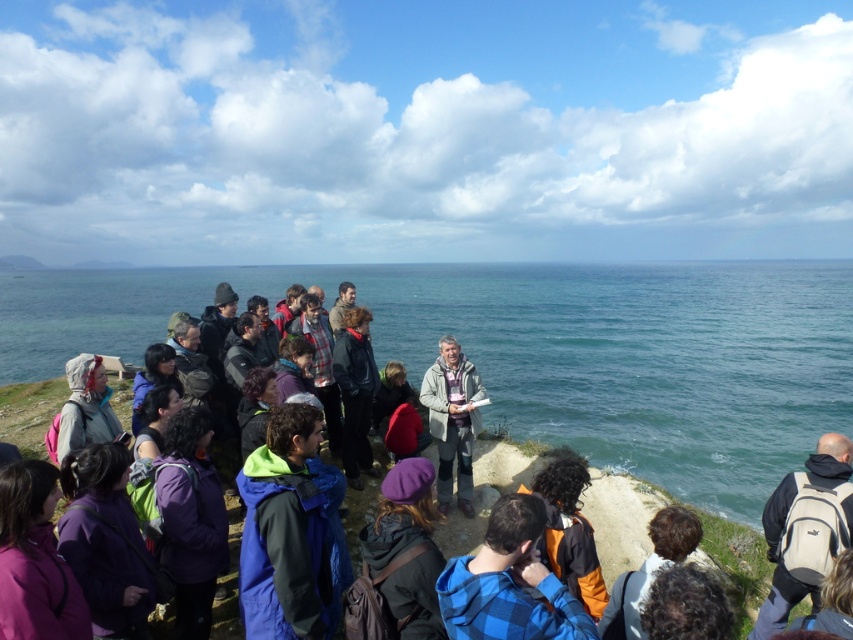
Question: Can you confirm if beige fabric backpack at lower right is positioned to the left of purple woolen hat at center?

Choices:
 (A) yes
 (B) no

Answer: (B)

Question: Which point is closer to the camera taking this photo?

Choices:
 (A) tap(476, 417)
 (B) tap(86, 300)
 (C) tap(16, 465)

Answer: (C)

Question: Can you confirm if orange fabric jacket at lower center is wider than brown woolen hat at lower right?

Choices:
 (A) no
 (B) yes

Answer: (A)

Question: Which of these objects is positioned farthest from the purple woolen hat at center?

Choices:
 (A) matte gray jacket at lower left
 (B) blue fabric jacket at lower left
 (C) purple fleece jacket at lower left

Answer: (A)

Question: Is blue water at center thinner than brown woolen hat at lower right?

Choices:
 (A) no
 (B) yes

Answer: (A)

Question: Which point is farther to the camera?

Choices:
 (A) (294, 504)
 (B) (576, 534)

Answer: (B)